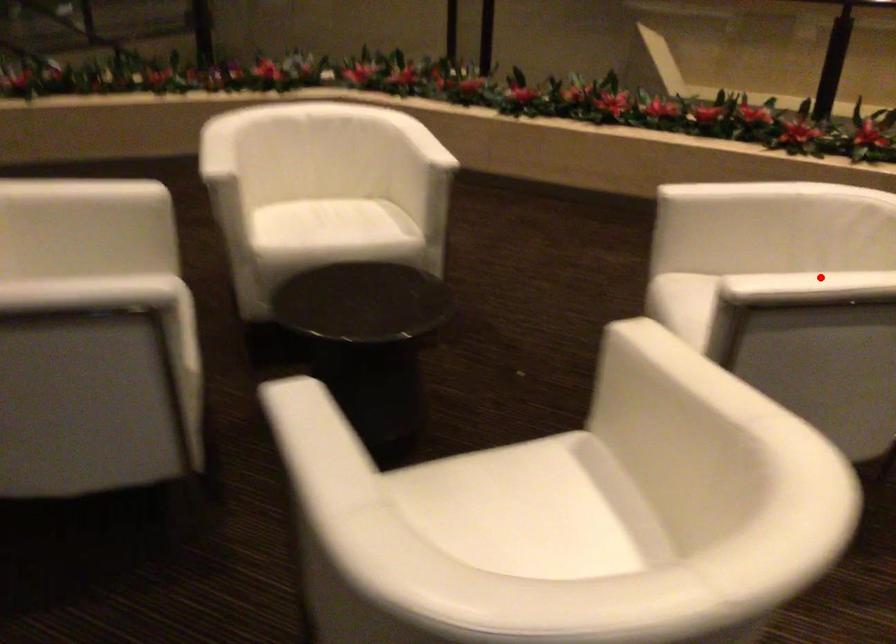
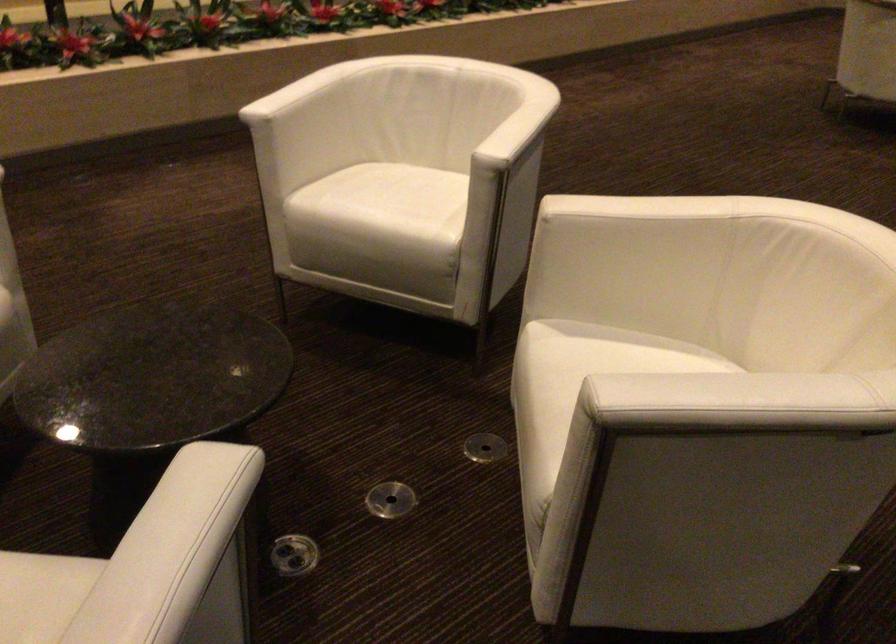
Question: I am providing you with two images of the same scene from different viewpoints. Given a red point in image1, look at the same physical point in image2. Is it:

Choices:
 (A) Closer to the viewpoint
 (B) Farther from the viewpoint

Answer: (B)